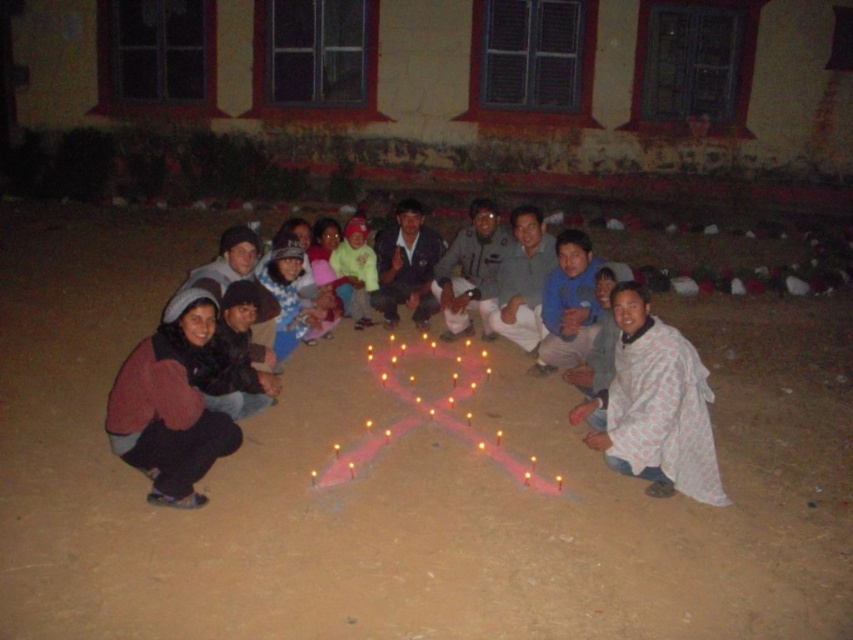
Based on the photo, does white printed cloth at lower right appear over light yellow fabric at center?

Incorrect, white printed cloth at lower right is not positioned above light yellow fabric at center.

Between white printed cloth at lower right and light yellow fabric at center, which one is positioned higher?

light yellow fabric at center

Locate an element on the screen. The height and width of the screenshot is (640, 853). white printed cloth at lower right is located at coordinates (654, 406).

This screenshot has height=640, width=853. What are the coordinates of `white printed cloth at lower right` in the screenshot? It's located at (654, 406).